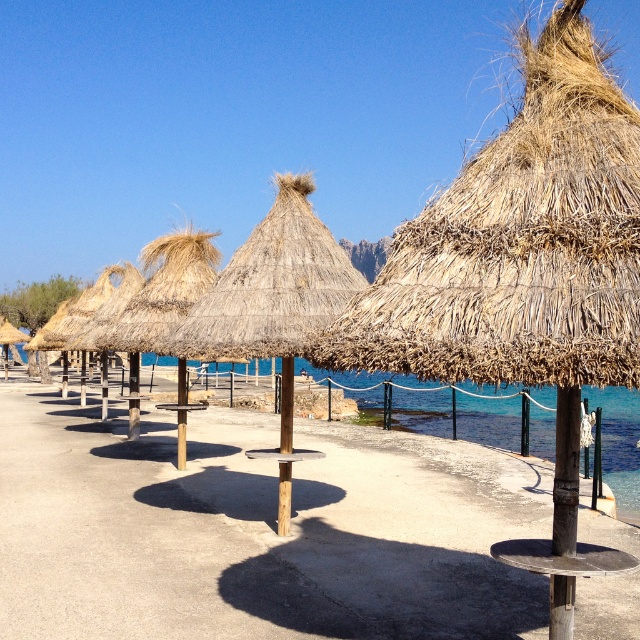
You are a tourist walking along the beach and want to reach the water. You see the brown wooden path at center and the natural straw umbrella at center. Which object is closer to you as you walk towards the water?

The brown wooden path at center is closer to you because it is further to the viewer than the natural straw umbrella at center, meaning it is positioned nearer along your line of sight towards the water.

You are standing at the center of the beach and see the point marked at coordinates (275,291). What object is located exactly at that point?

The natural straw umbrella at center is located exactly at point (275,291).